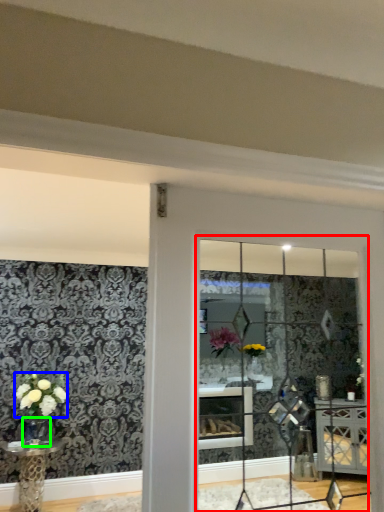
Question: Which is nearer to the glass window (highlighted by a red box)? flower (highlighted by a blue box) or glass vase (highlighted by a green box).

Choices:
 (A) flower
 (B) glass vase

Answer: (A)